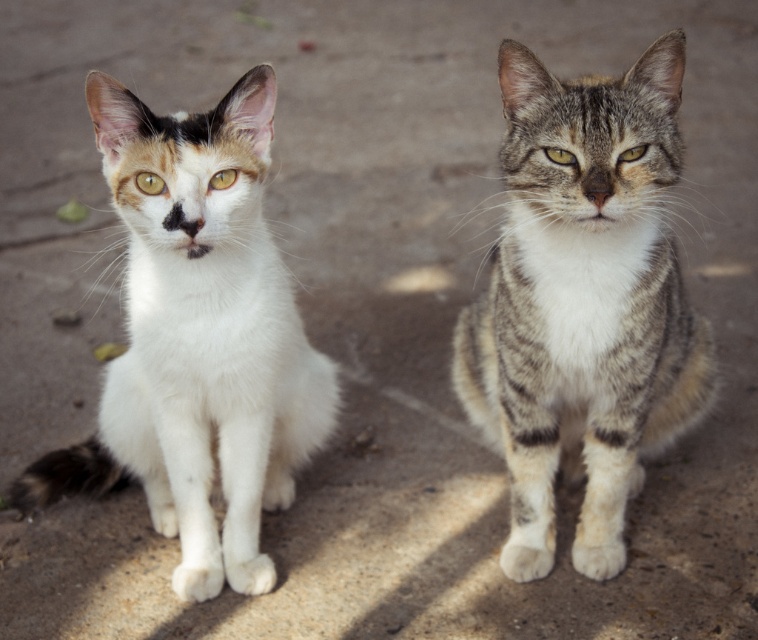
You are a photographer trying to capture a closeup of both cats. Given that your camera can focus on objects within a 15 inch range, will you be able to focus on both the tabby fur cat at center and the white soft fur cat at left simultaneously?

The tabby fur cat at center is 18.14 inches from the white soft fur cat at left, which exceeds the camera focus range of 15 inches. Therefore, you cannot focus on both cats simultaneously.

Based on the photo, you are a photographer trying to capture a clear photo of the tabby fur cat at center and the white soft fur cat at left. Since the background is out of focus, which cat should you focus on to ensure the one closer to the camera is sharp?

The tabby fur cat at center is positioned over white soft fur cat at left, meaning it is closer to the camera. Focus on the tabby fur cat at center to ensure it is sharp.

You are a photographer trying to capture both cats in a single frame. Given that the tabby fur cat at center and the white soft fur cat at left are sitting side by side, which cat do you need to adjust your camera angle to include more of?

The white soft fur cat at left occupies more space than the tabby fur cat at center, so you need to adjust your camera angle to include more of the white soft fur cat at left.